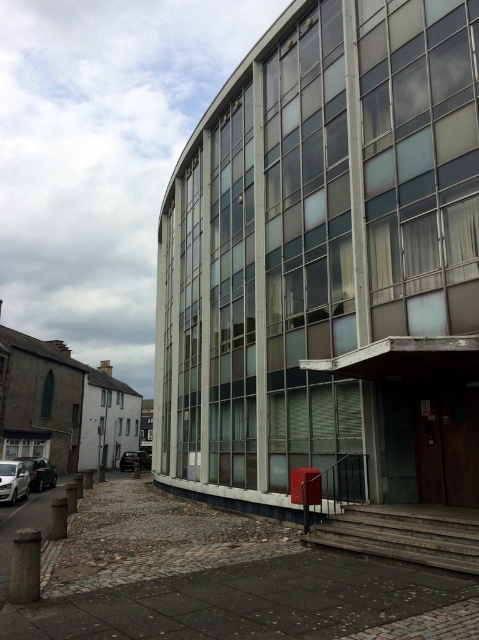
You are standing at the entrance of the modern building and want to locate the white glossy car at lower left. According to the coordinates provided, where should you look relative to your current position?

The white glossy car at lower left is located at point (13, 481). Since the coordinates are given in the lower left quadrant, you should look to your lower left direction from the entrance to find it.

You are a delivery driver who needs to park your vehicle in the area shown. You have two cars available, a shiny black car at lower left and a black matte car at lower left. According to the scene, which car is positioned higher up and might be closer to the building entrance?

The shiny black car at lower left is positioned above the black matte car at lower left, so it is higher up and closer to the building entrance.

You are a delivery person arriving at the building and need to park your vehicle. You have a shiny black car at lower left and a black matte car at lower left. Which car has more space available for parking in the area near the entrance?

The shiny black car at lower left is bigger than the black matte car at lower left, so the black matte car at lower left would require less space and thus have more available space for parking near the entrance.